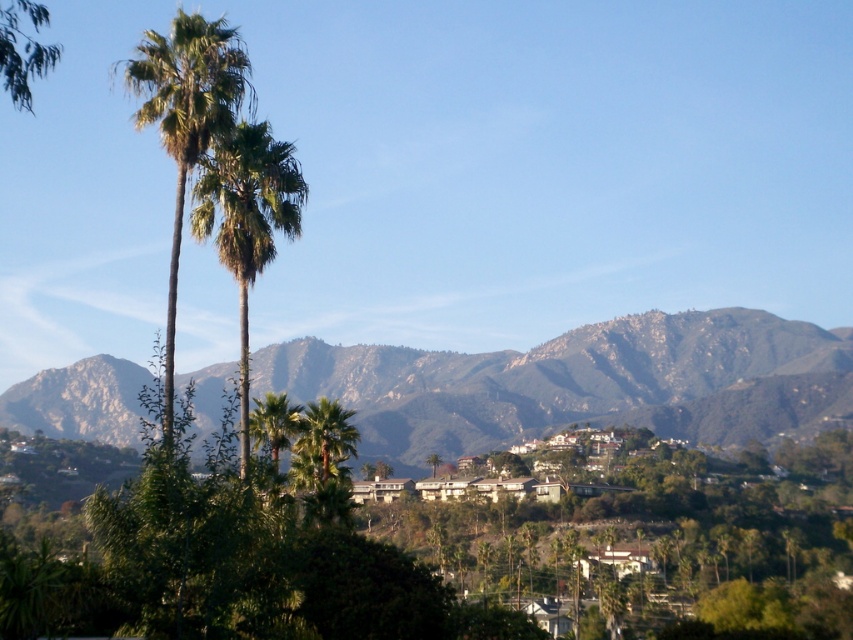
Does green rocky mountain range at center lie behind green leafy palm at left?

Yes, green rocky mountain range at center is behind green leafy palm at left.

Does green rocky mountain range at center have a lesser width compared to green leafy palm at left?

No, green rocky mountain range at center is not thinner than green leafy palm at left.

Who is more distant from viewer, [627,364] or [219,45]?

Point [627,364]

Where is `green rocky mountain range at center`? Image resolution: width=853 pixels, height=640 pixels. green rocky mountain range at center is located at coordinates (579, 381).

Based on the photo, does green rocky mountain range at center lie in front of green leafy palm tree at center?

No, it is not.

Which is more to the left, green rocky mountain range at center or green leafy palm tree at center?

Positioned to the left is green rocky mountain range at center.

Which is in front, point (212, 408) or point (248, 172)?

Point (248, 172)

Image resolution: width=853 pixels, height=640 pixels. I want to click on green rocky mountain range at center, so pyautogui.click(x=579, y=381).

Describe the element at coordinates (186, 120) in the screenshot. I see `green leafy palm at left` at that location.

Does green leafy palm at left appear on the left side of green leafy palm tree at center?

Yes, green leafy palm at left is to the left of green leafy palm tree at center.

Where is `green leafy palm at left`? green leafy palm at left is located at coordinates (186, 120).